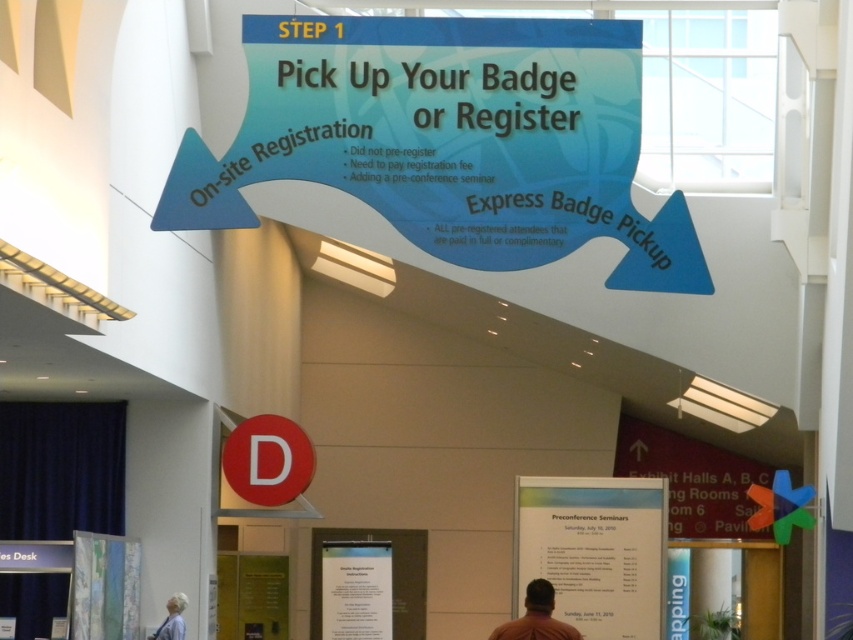
Question: Can you confirm if brown shirt at center is positioned below white fabric at lower left?

Choices:
 (A) no
 (B) yes

Answer: (A)

Question: Is brown shirt at center thinner than white fabric at lower left?

Choices:
 (A) no
 (B) yes

Answer: (A)

Question: Which of the following is the closest to the observer?

Choices:
 (A) (177, 600)
 (B) (506, 637)

Answer: (B)

Question: Which point is closer to the camera?

Choices:
 (A) white fabric at lower left
 (B) brown shirt at center

Answer: (B)

Question: Does brown shirt at center appear over white fabric at lower left?

Choices:
 (A) no
 (B) yes

Answer: (B)